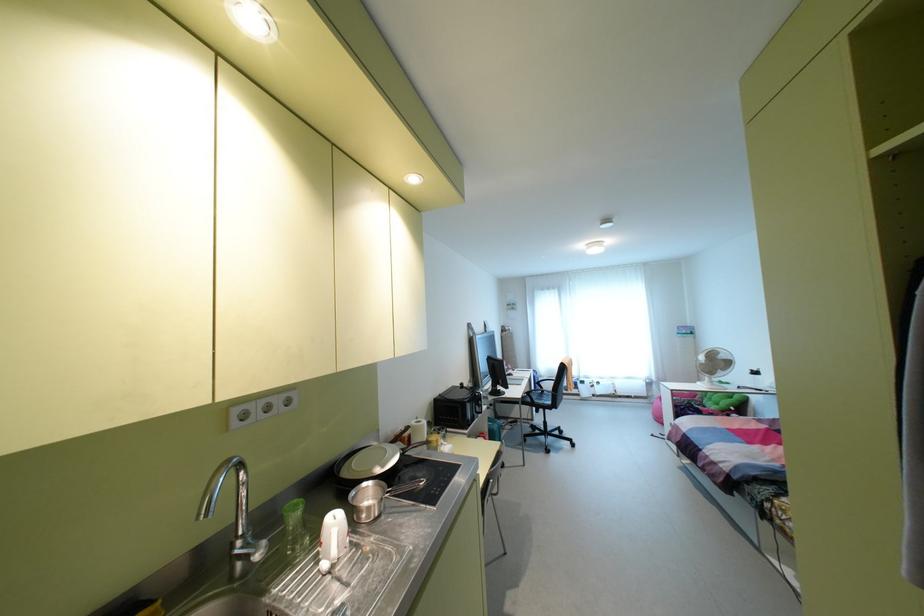
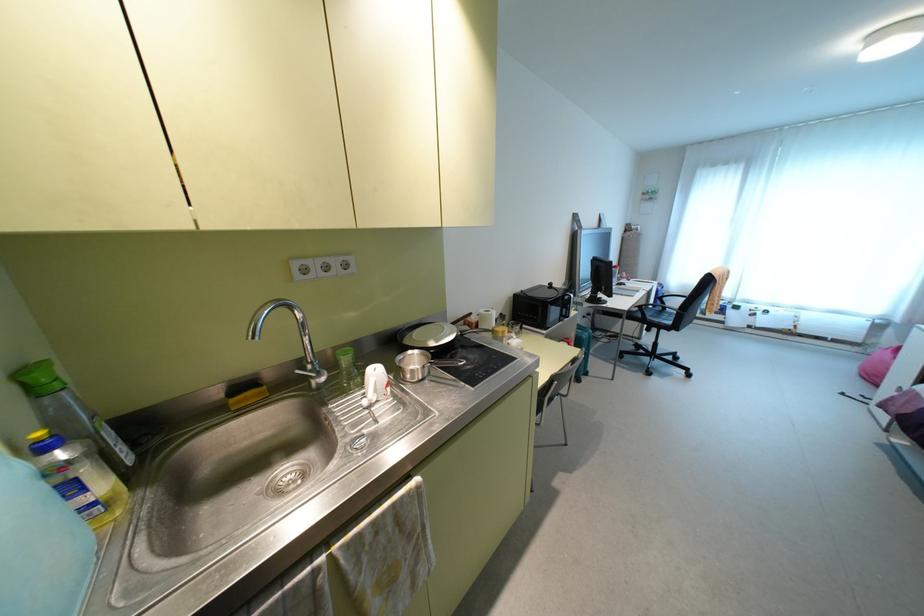
Locate, in the second image, the point that corresponds to point 548,402 in the first image.

(667, 322)